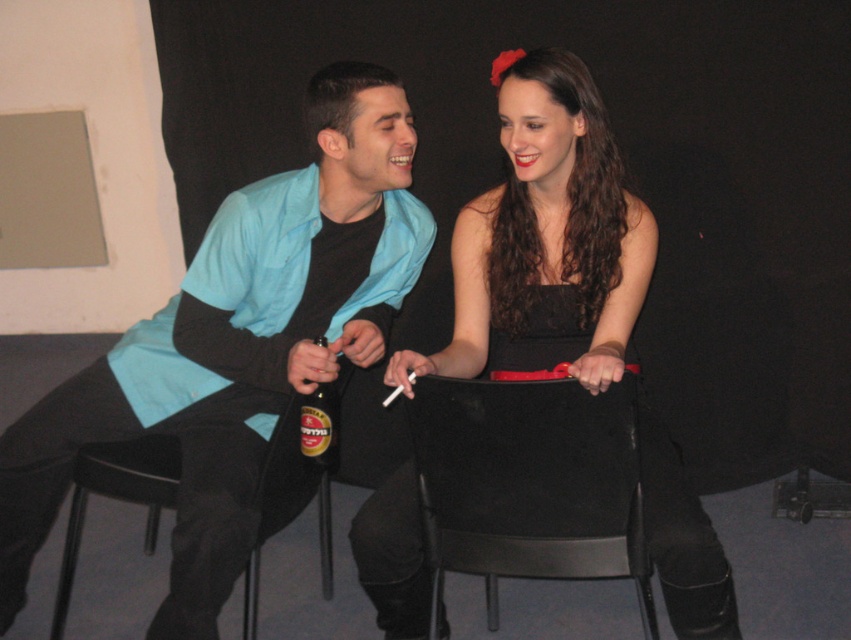
Question: Which point is closer to the camera?

Choices:
 (A) metallic gold beer bottle at center
 (B) black fabric chair at center
 (C) black satin dress at center
 (D) black plastic chair at lower left

Answer: (B)

Question: Which point is closer to the camera?

Choices:
 (A) (595, 483)
 (B) (323, 337)

Answer: (A)

Question: Can you confirm if matte blue shirt at left is smaller than metallic gold beer bottle at center?

Choices:
 (A) no
 (B) yes

Answer: (A)

Question: Can you confirm if matte blue shirt at left is positioned to the left of metallic gold beer bottle at center?

Choices:
 (A) yes
 (B) no

Answer: (A)

Question: Is black satin dress at center positioned behind black fabric chair at center?

Choices:
 (A) yes
 (B) no

Answer: (A)

Question: Which is farther from the black fabric chair at center?

Choices:
 (A) black plastic chair at lower left
 (B) metallic gold beer bottle at center
 (C) matte blue shirt at left
 (D) black satin dress at center

Answer: (A)